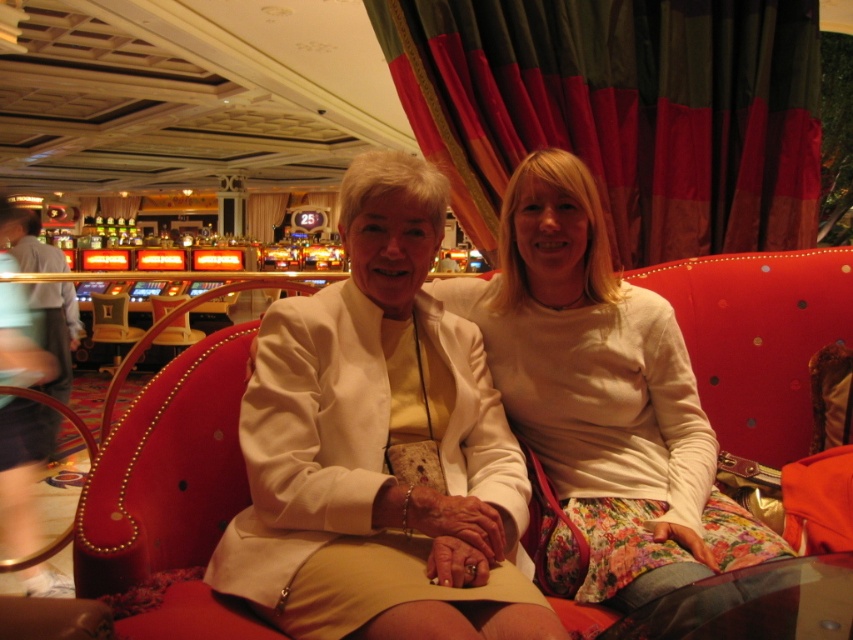
Question: Which of these objects is positioned closest to the velvet-like curtain at upper center?

Choices:
 (A) metallic silver armchair at center
 (B) white cotton sweater at center

Answer: (B)

Question: Which object is positioned farthest from the velvet-like curtain at upper center?

Choices:
 (A) metallic silver armchair at center
 (B) white cotton sweater at center

Answer: (A)

Question: Is white cotton sweater at center to the right of metallic silver armchair at center from the viewer's perspective?

Choices:
 (A) yes
 (B) no

Answer: (A)

Question: Estimate the real-world distances between objects in this image. Which object is closer to the metallic silver armchair at center?

Choices:
 (A) white cotton sweater at center
 (B) velvet-like curtain at upper center

Answer: (B)

Question: Observing the image, what is the correct spatial positioning of velvet-like curtain at upper center in reference to white cotton sweater at center?

Choices:
 (A) above
 (B) below

Answer: (A)

Question: Is the position of velvet-like curtain at upper center less distant than that of metallic silver armchair at center?

Choices:
 (A) no
 (B) yes

Answer: (B)